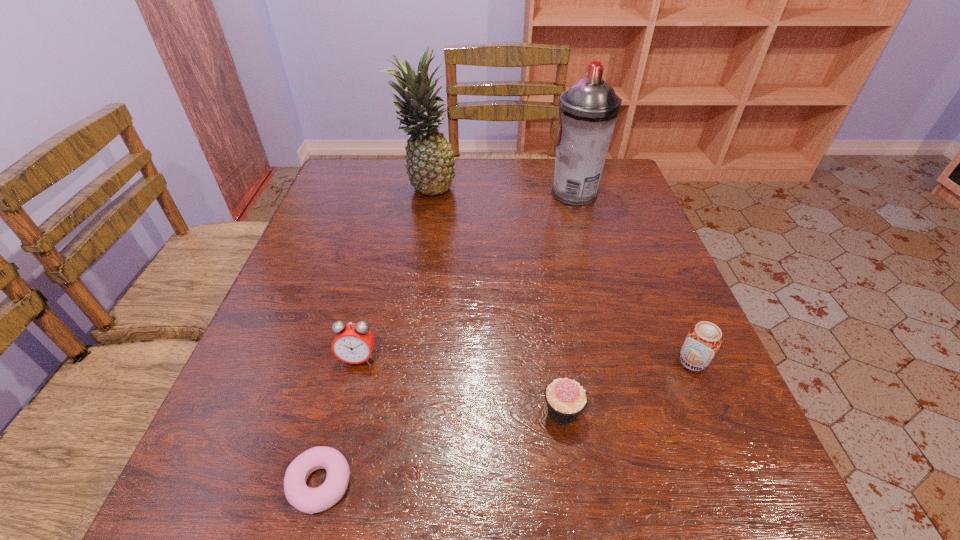
You are a GUI agent. You are given a task and a screenshot of the screen. Output one action in this format:
    pyautogui.click(x=<x>, y=<y>)
    Task: Click on the vacant space located 0.110m on the front-facing side of the alarm clock
    This screenshot has width=960, height=540.
    Given the screenshot: What is the action you would take?
    pyautogui.click(x=342, y=425)

What are the coordinates of `vacant position located on the back of the beer can` in the screenshot? It's located at (657, 278).

Find the location of a particular element. The width and height of the screenshot is (960, 540). free spot located on the front of the second nearest object is located at coordinates (580, 525).

At what (x,y) coordinates should I click in order to perform the action: click on vacant space located on the right of the pastry. Please return your answer as a coordinate pair (x, y). Looking at the image, I should click on (575, 484).

Find the location of a particular element. The image size is (960, 540). pineapple at the far edge is located at coordinates (429, 157).

Find the location of `aerosol can located at the far edge`. aerosol can located at the far edge is located at coordinates (588, 111).

This screenshot has height=540, width=960. Identify the location of object that is at the near edge. (309, 500).

Where is `object located in the left edge section of the desktop`? The width and height of the screenshot is (960, 540). object located in the left edge section of the desktop is located at coordinates (309, 500).

Identify the location of aerosol can that is positioned at the right edge. (588, 111).

The image size is (960, 540). Find the location of `beer can at the right edge`. beer can at the right edge is located at coordinates (704, 339).